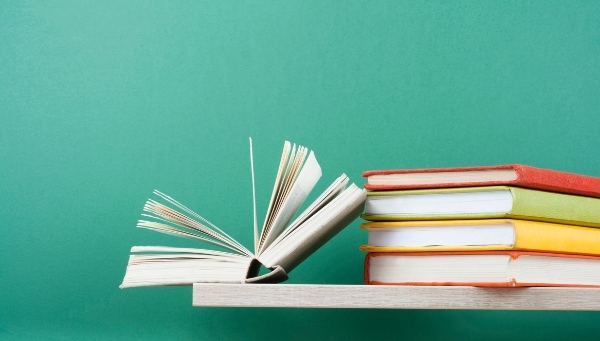
This screenshot has width=600, height=341. I want to click on books, so click(490, 178), click(492, 200), click(497, 229), click(493, 274), click(265, 275).